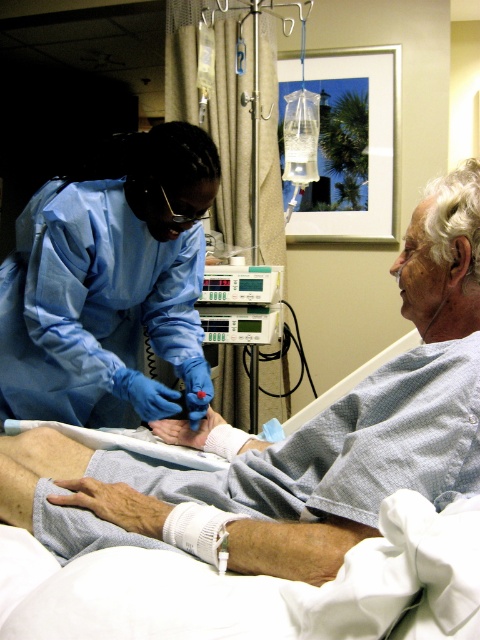
You are a medical student observing a healthcare professional in a hospital room. You notice two pairs of blue smooth gloves. Which pair is closer to you, the blue smooth gloves at upper left or the blue smooth gloves at left?

The blue smooth gloves at upper left are closer to you because they are positioned nearer to the viewer compared to the blue smooth gloves at left.

You are a nurse in the hospital room. You need to quickly grab a pair of gloves. There are two pairs available in the scene. The first is the blue smooth gloves at upper left, and the second is the blue smooth gloves at left. Which pair is closer to you?

The blue smooth gloves at upper left is 45.20 centimeters away from blue smooth gloves at left, so the blue smooth gloves at left is closer to you.

You are a medical student observing a healthcare professional in a hospital room. You notice two points marked in the scene. Which point is closer to you, point (377, 499) or point (115, 198)?

Point (377, 499) is closer to the viewer than point (115, 198).